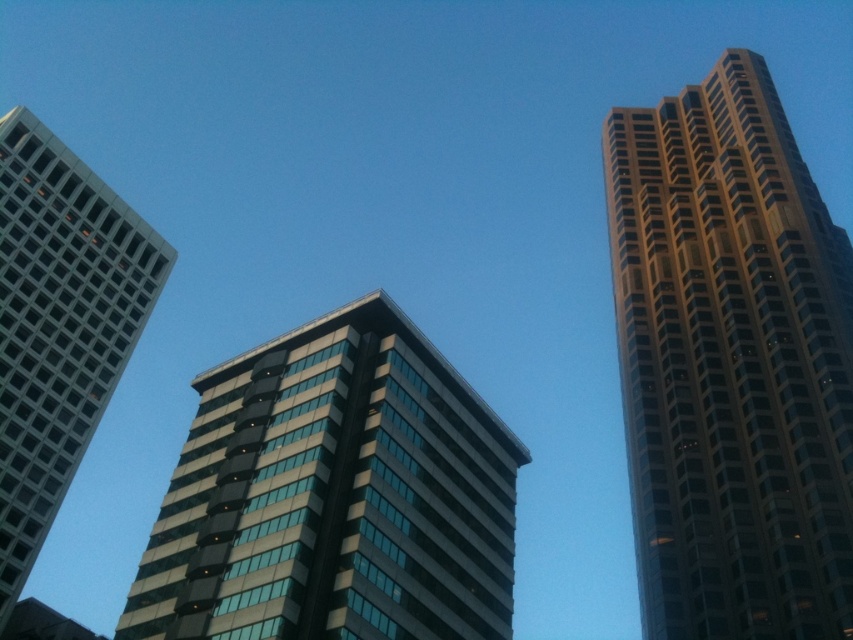
Question: Which of the following is the closest to the observer?

Choices:
 (A) matte glass skyscraper at left
 (B) gold glassy building at right
 (C) glassy reflective building at center

Answer: (C)

Question: Among these points, which one is nearest to the camera?

Choices:
 (A) (96, 349)
 (B) (242, 621)

Answer: (B)

Question: Does glassy reflective building at center appear on the right side of matte glass skyscraper at left?

Choices:
 (A) no
 (B) yes

Answer: (B)

Question: Does glassy reflective building at center appear under matte glass skyscraper at left?

Choices:
 (A) yes
 (B) no

Answer: (A)

Question: Considering the real-world distances, which object is closest to the gold glassy building at right?

Choices:
 (A) glassy reflective building at center
 (B) matte glass skyscraper at left

Answer: (A)

Question: Is gold glassy building at right thinner than glassy reflective building at center?

Choices:
 (A) no
 (B) yes

Answer: (A)